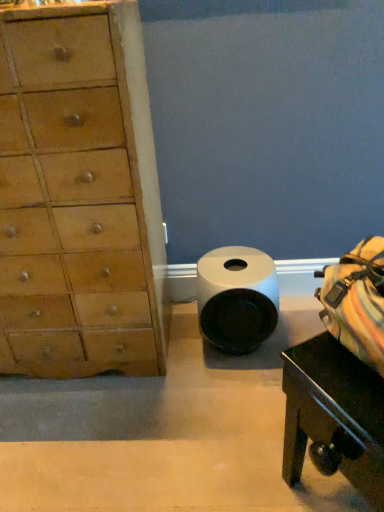
Question: In terms of width, does light brown wood chest of drawers at left look wider or thinner when compared to black glossy table at lower right?

Choices:
 (A) thin
 (B) wide

Answer: (B)

Question: From a real-world perspective, relative to black glossy table at lower right, is light brown wood chest of drawers at left vertically above or below?

Choices:
 (A) below
 (B) above

Answer: (B)

Question: Considering the real-world distances, which object is farthest from the white matte toilet paper at center?

Choices:
 (A) black glossy table at lower right
 (B) light brown wood chest of drawers at left

Answer: (A)

Question: Considering the real-world distances, which object is closest to the black glossy table at lower right?

Choices:
 (A) light brown wood chest of drawers at left
 (B) white matte toilet paper at center

Answer: (B)